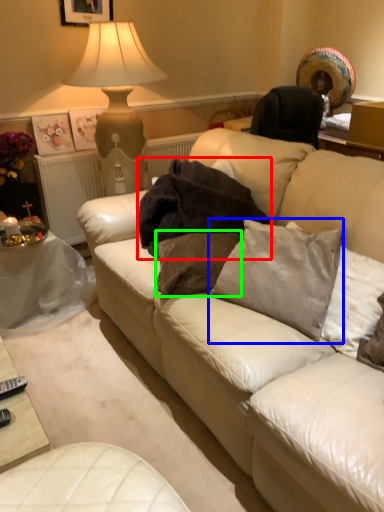
Question: Which object is positioned closest to blanket (highlighted by a red box)? Select from pillow (highlighted by a blue box) and pillow (highlighted by a green box).

Choices:
 (A) pillow
 (B) pillow

Answer: (B)